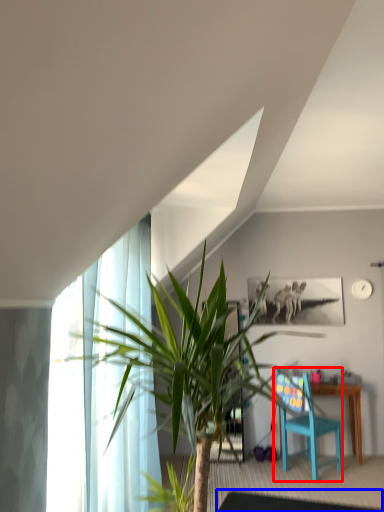
Question: Among these objects, which one is nearest to the camera, chair (highlighted by a red box) or glass table (highlighted by a blue box)?

Choices:
 (A) chair
 (B) glass table

Answer: (B)